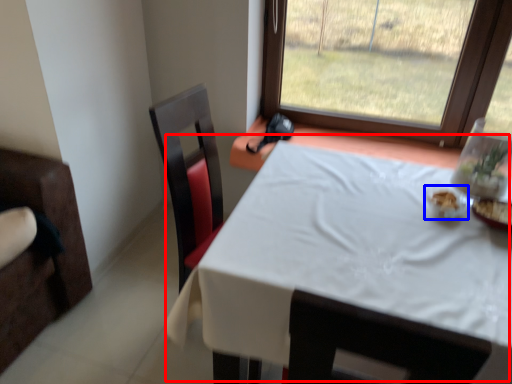
Question: Which object is closer to the camera taking this photo, table (highlighted by a red box) or tableware (highlighted by a blue box)?

Choices:
 (A) table
 (B) tableware

Answer: (A)